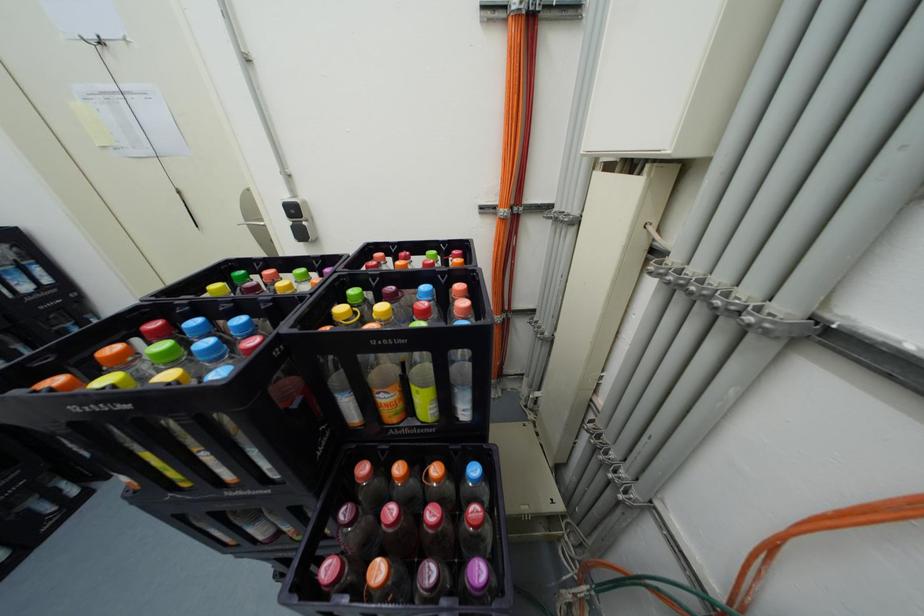
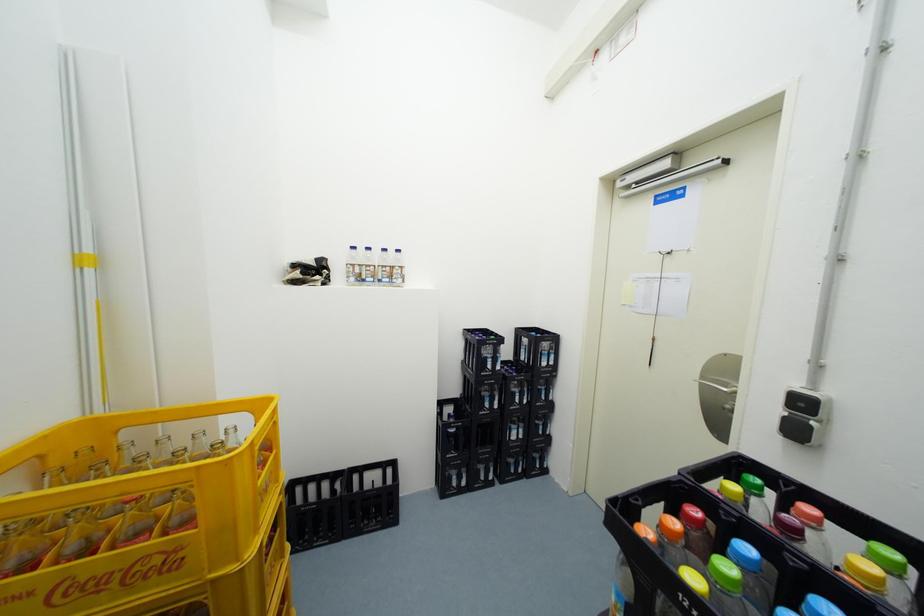
Question: The camera is either moving clockwise (left) or counter-clockwise (right) around the object. The first image is from the beginning of the video and the second image is from the end. Is the camera moving left or right when shooting the video?

Choices:
 (A) Left
 (B) Right

Answer: (B)